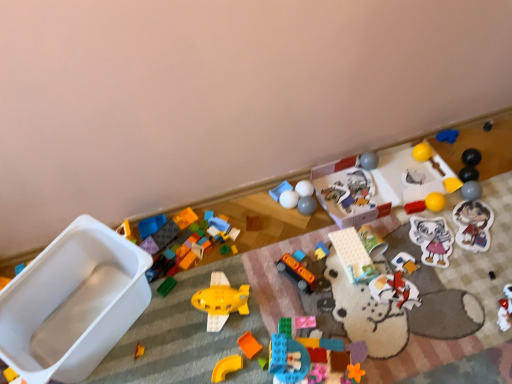
The height and width of the screenshot is (384, 512). I want to click on empty space that is in between orange plastic block at lower left, which is the third toy in left-to-right order, and orange matte block at center, acting as the sixth toy starting from the left, so click(195, 351).